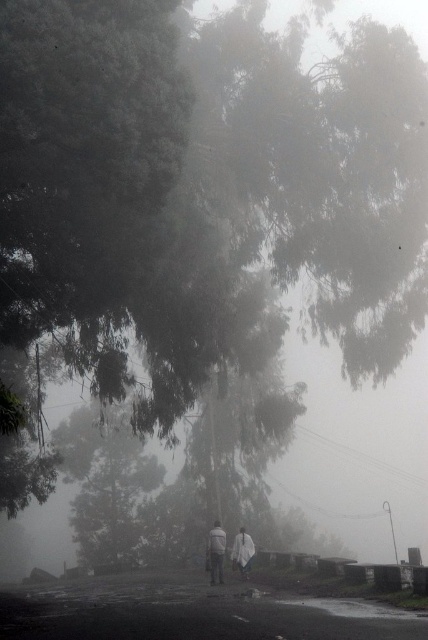
You are standing at the start of the pathway and see the two figures wearing the white matte coat at center and the white matte jacket at center. Which one is closer to you?

The white matte coat at center is closer to you because it is in front of the white matte jacket at center.

Looking at this image, you are a photographer standing at the edge of the misty forest. You want to capture both the white matte coat at center and the white matte jacket at lower center in a single frame. Can you fit both into your camera viewfinder without moving your position?

The distance between the white matte coat at center and the white matte jacket at lower center is 5.08 inches. Since the camera viewfinder can typically accommodate objects within such a close proximity, both can be captured in a single frame without moving your position.

You are a photographer trying to capture the two figures in the misty scene. Which of the two, the white matte coat at center or the white matte jacket at center, will appear smaller in your photo?

The white matte coat at center will appear smaller in the photo because it has a smaller size compared to the white matte jacket at center.